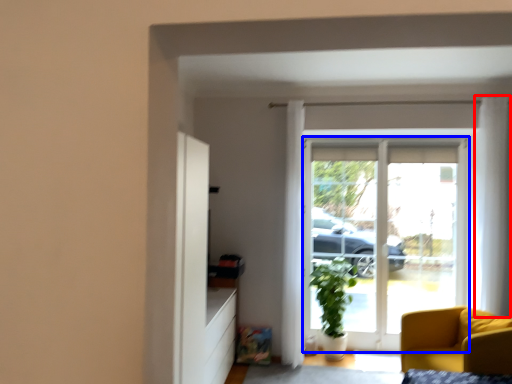
Question: Which object is closer to the camera taking this photo, curtain (highlighted by a red box) or door (highlighted by a blue box)?

Choices:
 (A) curtain
 (B) door

Answer: (A)